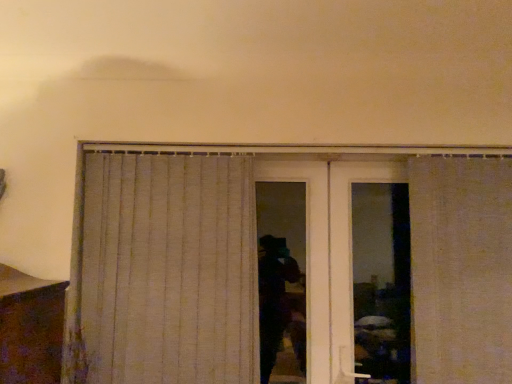
Question: From a real-world perspective, is beige fabric curtain at center, which is the 2th curtain in right-to-left order, physically located above or below white textured curtain at right, which ranks as the 2th curtain in left-to-right order?

Choices:
 (A) above
 (B) below

Answer: (B)

Question: Is point (202, 155) positioned closer to the camera than point (475, 302)?

Choices:
 (A) closer
 (B) farther

Answer: (B)

Question: Is beige fabric curtain at center, the 1th curtain positioned from the left, to the left or to the right of white textured curtain at right, which is the 1th curtain in right-to-left order, in the image?

Choices:
 (A) right
 (B) left

Answer: (B)

Question: Considering the positions of point (415, 195) and point (91, 309), is point (415, 195) closer or farther from the camera than point (91, 309)?

Choices:
 (A) farther
 (B) closer

Answer: (A)

Question: In terms of height, does white textured curtain at right, which is the 1th curtain in right-to-left order, look taller or shorter compared to beige fabric curtain at center, the 1th curtain positioned from the left?

Choices:
 (A) tall
 (B) short

Answer: (B)

Question: Is white textured curtain at right, which ranks as the 2th curtain in left-to-right order, inside the boundaries of beige fabric curtain at center, the 1th curtain positioned from the left, or outside?

Choices:
 (A) outside
 (B) inside

Answer: (A)

Question: In terms of width, does white textured curtain at right, which is the 1th curtain in right-to-left order, look wider or thinner when compared to beige fabric curtain at center, which is the 2th curtain in right-to-left order?

Choices:
 (A) thin
 (B) wide

Answer: (B)